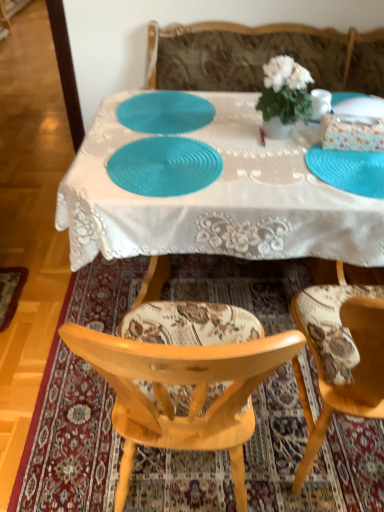
Find the location of `vacant region to the left of white matte flower pot at center`. vacant region to the left of white matte flower pot at center is located at coordinates (233, 130).